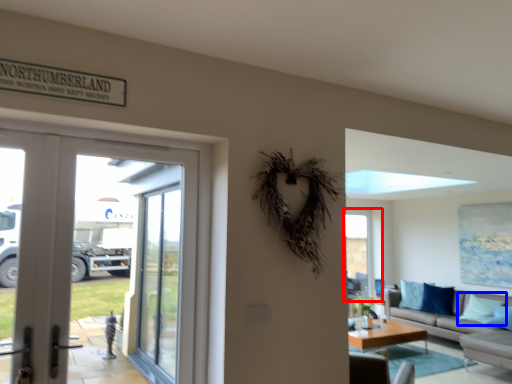
Question: Which object is closer to the camera taking this photo, window (highlighted by a red box) or pillow (highlighted by a blue box)?

Choices:
 (A) window
 (B) pillow

Answer: (B)